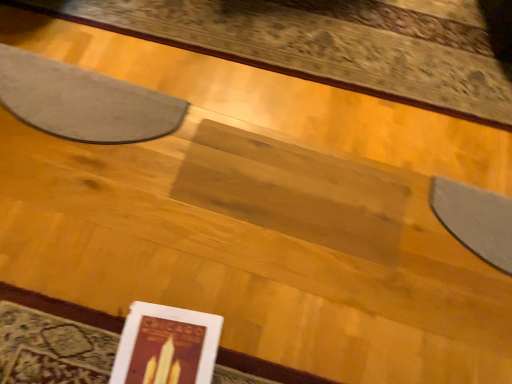
What do you see at coordinates (83, 101) in the screenshot?
I see `gray felt mat at upper left` at bounding box center [83, 101].

This screenshot has height=384, width=512. Find the location of `gray felt mat at upper left`. gray felt mat at upper left is located at coordinates (83, 101).

The width and height of the screenshot is (512, 384). I want to click on matte paper book at lower left, so click(166, 346).

Image resolution: width=512 pixels, height=384 pixels. Describe the element at coordinates (166, 346) in the screenshot. I see `matte paper book at lower left` at that location.

Find the location of a particular element. gray felt mat at upper left is located at coordinates (83, 101).

Would you say gray felt mat at upper left is to the left or to the right of matte paper book at lower left in the picture?

gray felt mat at upper left is positioned on matte paper book at lower left's left side.

Between gray felt mat at upper left and matte paper book at lower left, which one is positioned in front?

matte paper book at lower left is in front.

Which is in front, point (117, 110) or point (187, 355)?

The point (187, 355) is closer to the camera.

From the image's perspective, does gray felt mat at upper left appear higher than matte paper book at lower left?

Correct, gray felt mat at upper left appears higher than matte paper book at lower left in the image.

From a real-world perspective, who is located higher, gray felt mat at upper left or matte paper book at lower left?

matte paper book at lower left is physically above.

Which of these two, gray felt mat at upper left or matte paper book at lower left, is wider?

With larger width is matte paper book at lower left.

Can you confirm if gray felt mat at upper left is taller than matte paper book at lower left?

Indeed, gray felt mat at upper left has a greater height compared to matte paper book at lower left.

Is gray felt mat at upper left bigger than matte paper book at lower left?

Yes, gray felt mat at upper left is bigger than matte paper book at lower left.

Is gray felt mat at upper left located outside matte paper book at lower left?

Indeed, gray felt mat at upper left is completely outside matte paper book at lower left.

Is gray felt mat at upper left not close to matte paper book at lower left?

No, there isn't a large distance between gray felt mat at upper left and matte paper book at lower left.

In the scene shown: Is gray felt mat at upper left aimed at matte paper book at lower left?

No, gray felt mat at upper left is not turned towards matte paper book at lower left.

How many degrees apart are the facing directions of gray felt mat at upper left and matte paper book at lower left?

The facing directions of gray felt mat at upper left and matte paper book at lower left are 6.46 degrees apart.

Identify the location of paperback book lying below the gray felt mat at upper left (from the image's perspective). (166, 346).

Considering the relative positions of matte paper book at lower left and gray felt mat at upper left in the image provided, is matte paper book at lower left to the left of gray felt mat at upper left from the viewer's perspective?

No, matte paper book at lower left is not to the left of gray felt mat at upper left.

Is matte paper book at lower left positioned in front of gray felt mat at upper left?

Yes, it is.

Which is behind, point (113, 372) or point (1, 53)?

Positioned behind is point (1, 53).

From the image's perspective, does matte paper book at lower left appear lower than gray felt mat at upper left?

Yes, from the image's perspective, matte paper book at lower left is below gray felt mat at upper left.

From a real-world perspective, does matte paper book at lower left stand above gray felt mat at upper left?

Yes, from a real-world perspective, matte paper book at lower left is over gray felt mat at upper left

Does matte paper book at lower left have a lesser width compared to gray felt mat at upper left?

No.

Who is shorter, matte paper book at lower left or gray felt mat at upper left?

With less height is matte paper book at lower left.

Does matte paper book at lower left have a larger size compared to gray felt mat at upper left?

Actually, matte paper book at lower left might be smaller than gray felt mat at upper left.

Is gray felt mat at upper left surrounded by matte paper book at lower left?

No, matte paper book at lower left does not contain gray felt mat at upper left.

Is there a large distance between matte paper book at lower left and gray felt mat at upper left?

They are positioned close to each other.

From the picture: Does matte paper book at lower left turn towards gray felt mat at upper left?

No, matte paper book at lower left is not turned towards gray felt mat at upper left.

The image size is (512, 384). Find the location of `paperback book on the right of gray felt mat at upper left`. paperback book on the right of gray felt mat at upper left is located at coordinates (166, 346).

Locate an element on the screen. paperback book lying on the right of gray felt mat at upper left is located at coordinates (166, 346).

Find the location of a particular element. This screenshot has width=512, height=384. mat on the left side of matte paper book at lower left is located at coordinates (83, 101).